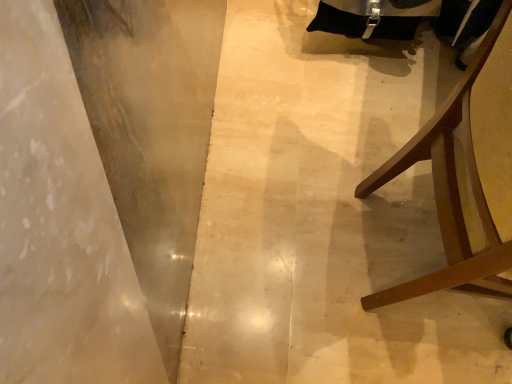
Find the location of a particular element. The height and width of the screenshot is (384, 512). free location above smooth concrete at left (from a real-world perspective) is located at coordinates (323, 174).